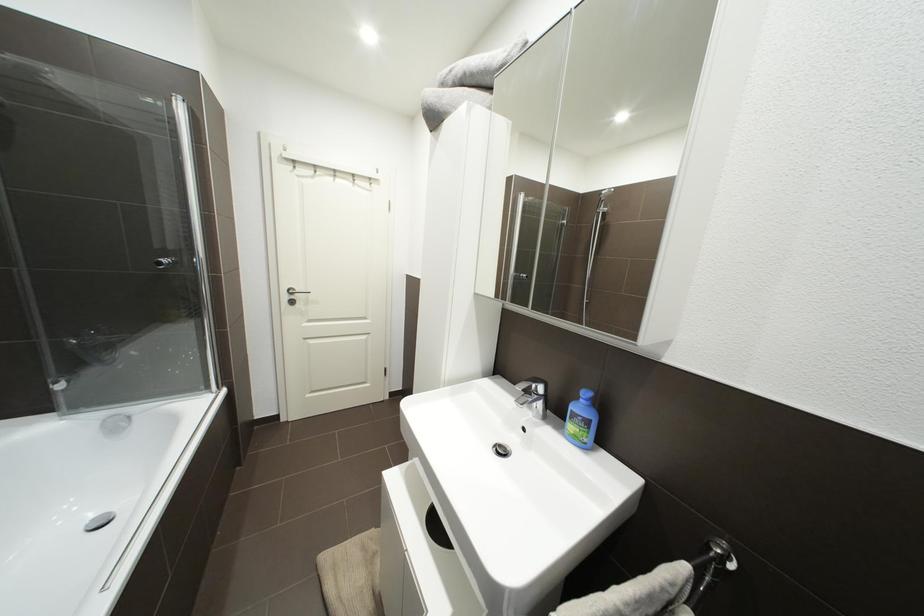
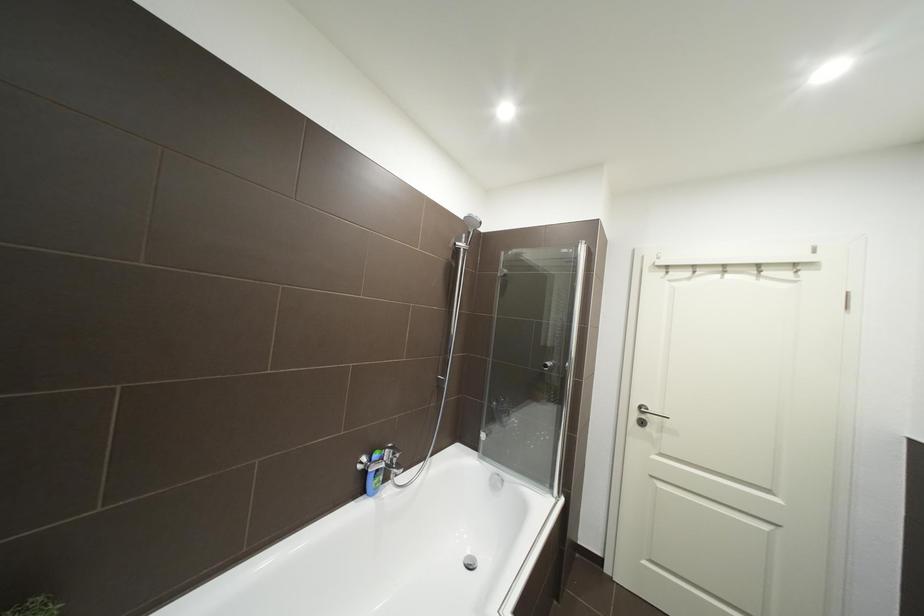
Question: Based on the continuous images, in which direction is the camera rotating? Reply with the corresponding letter.

Choices:
 (A) Left
 (B) Right
 (C) Up
 (D) Down

Answer: (A)